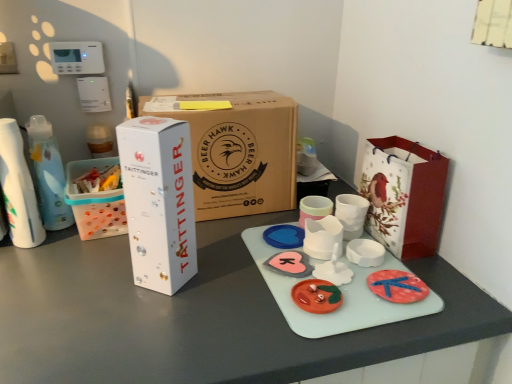
Question: Does white glossy box at left, which ranks as the second box in back-to-front order, have a greater width compared to white cardboard box at left?

Choices:
 (A) yes
 (B) no

Answer: (B)

Question: Is white glossy box at left, marked as the 1th box in a front-to-back arrangement, not within white cardboard box at left?

Choices:
 (A) yes
 (B) no

Answer: (A)

Question: Is white glossy box at left, marked as the 1th box in a front-to-back arrangement, taller than white cardboard box at left?

Choices:
 (A) yes
 (B) no

Answer: (A)

Question: From the image's perspective, is white glossy box at left, marked as the 1th box in a front-to-back arrangement, located above white cardboard box at left?

Choices:
 (A) yes
 (B) no

Answer: (B)

Question: From a real-world perspective, does white glossy box at left, which ranks as the second box in back-to-front order, sit lower than white cardboard box at left?

Choices:
 (A) yes
 (B) no

Answer: (B)

Question: In terms of size, does white glossy cup at center, which is counted as the 3th toy, starting from the back, appear bigger or smaller than white paper bag with red bird design at right?

Choices:
 (A) small
 (B) big

Answer: (A)

Question: Does point (340, 264) appear closer or farther from the camera than point (416, 226)?

Choices:
 (A) closer
 (B) farther

Answer: (A)

Question: Do you think white glossy cup at center, the second toy positioned from the front, is within white paper bag with red bird design at right, or outside of it?

Choices:
 (A) inside
 (B) outside

Answer: (B)

Question: From their relative heights in the image, would you say white glossy cup at center, the second toy positioned from the front, is taller or shorter than white paper bag with red bird design at right?

Choices:
 (A) short
 (B) tall

Answer: (A)

Question: Based on their sizes in the image, would you say pink matte heart at center, the 3th toy in the front-to-back sequence, is bigger or smaller than white paper bag with red bird design at right?

Choices:
 (A) big
 (B) small

Answer: (B)

Question: From a real-world perspective, relative to white paper bag with red bird design at right, is pink matte heart at center, arranged as the 2th toy when viewed from the back, vertically above or below?

Choices:
 (A) below
 (B) above

Answer: (A)

Question: Considering the positions of point (280, 261) and point (373, 220), is point (280, 261) closer or farther from the camera than point (373, 220)?

Choices:
 (A) farther
 (B) closer

Answer: (B)

Question: From their relative heights in the image, would you say pink matte heart at center, arranged as the 2th toy when viewed from the back, is taller or shorter than white paper bag with red bird design at right?

Choices:
 (A) short
 (B) tall

Answer: (A)

Question: Is matte plastic toy at center, acting as the 1th toy starting from the front, inside or outside of brown cardboard box at center, the 1th box viewed from the back?

Choices:
 (A) outside
 (B) inside

Answer: (A)

Question: Relative to brown cardboard box at center, the 1th box viewed from the back, is matte plastic toy at center, acting as the 1th toy starting from the front, in front or behind?

Choices:
 (A) front
 (B) behind

Answer: (A)